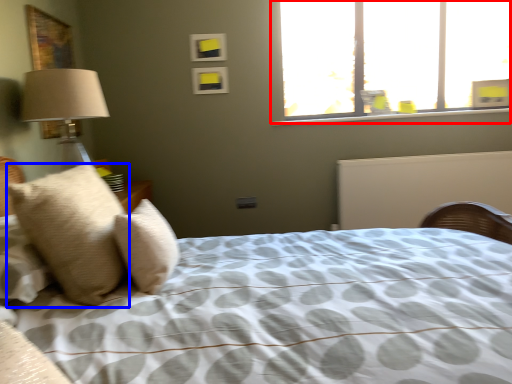
Question: Which object appears farthest to the camera in this image, window (highlighted by a red box) or pillow (highlighted by a blue box)?

Choices:
 (A) window
 (B) pillow

Answer: (A)